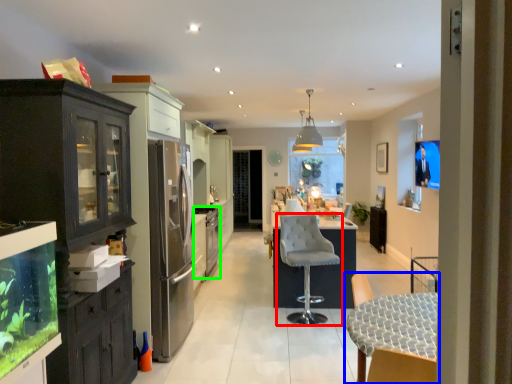
Question: Based on their relative distances, which object is farther from chair (highlighted by a red box)? Choose from chair (highlighted by a blue box) and appliance (highlighted by a green box).

Choices:
 (A) chair
 (B) appliance

Answer: (B)